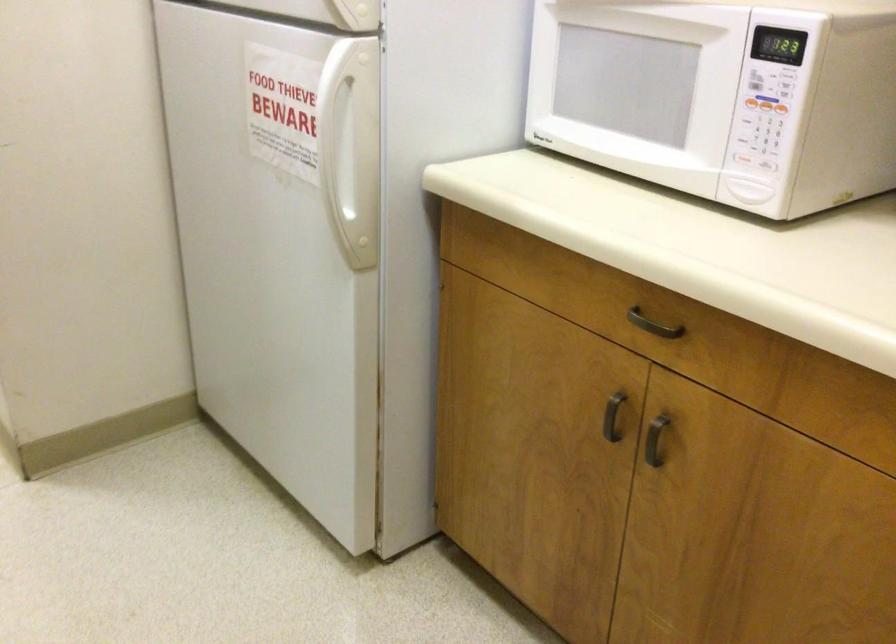
Find where to pull the metal drawer handle. Please return your answer as a coordinate pair (x, y).

(652, 325)